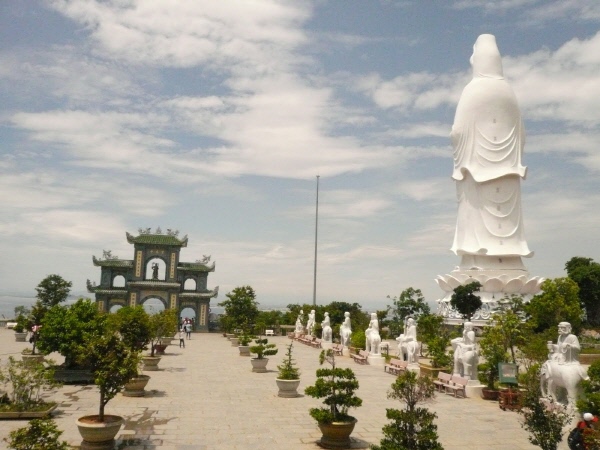
At what (x,y) coordinates should I click in order to perform the action: click on archway. Please return your answer as a coordinate pair (x, y). This screenshot has width=600, height=450. Looking at the image, I should click on (116, 306), (117, 277), (146, 272), (154, 303), (188, 277), (190, 313).